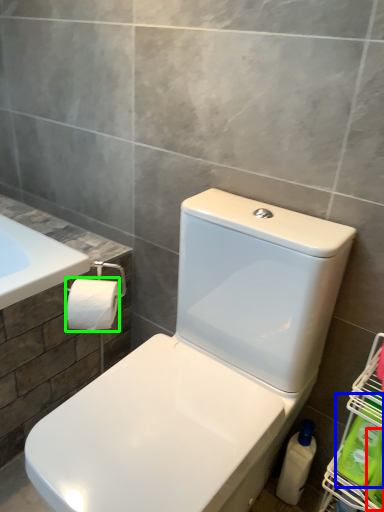
Question: Based on their relative distances, which object is farther from cleaning product (highlighted by a red box)? Choose from cleaning product (highlighted by a blue box) and toilet paper (highlighted by a green box).

Choices:
 (A) cleaning product
 (B) toilet paper

Answer: (B)